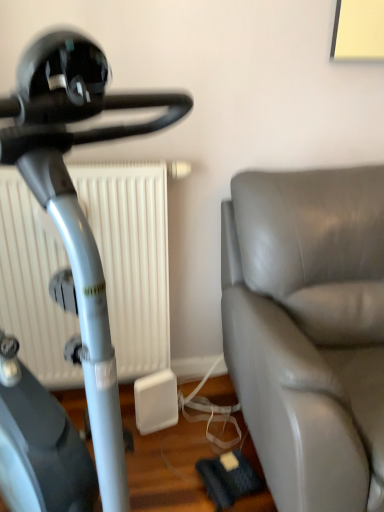
This screenshot has width=384, height=512. What do you see at coordinates (78, 207) in the screenshot? I see `matte black stationary bicycle at left` at bounding box center [78, 207].

The image size is (384, 512). Identify the location of gray leather couch at right. (308, 330).

You are a GUI agent. You are given a task and a screenshot of the screen. Output one action in this format:
    pyautogui.click(x=<x>, y=<y>)
    Task: Click on the white matte radiator at center
    The height and width of the screenshot is (512, 384).
    Given the screenshot: What is the action you would take?
    pyautogui.click(x=131, y=258)

Looking at this image, does gray leather couch at right turn towards white matte radiator at center?

No, gray leather couch at right is not facing towards white matte radiator at center.

How far apart are gray leather couch at right and white matte radiator at center?

gray leather couch at right is 22.91 inches from white matte radiator at center.

In the image, is gray leather couch at right on the left side or the right side of white matte radiator at center?

gray leather couch at right is to the right of white matte radiator at center.

You are a GUI agent. You are given a task and a screenshot of the screen. Output one action in this format:
    pyautogui.click(x=<x>, y=<y>)
    Task: Click on the studio couch in front of the white matte radiator at center
    The height and width of the screenshot is (512, 384).
    Given the screenshot: What is the action you would take?
    pyautogui.click(x=308, y=330)

Considering the positions of point (131, 248) and point (337, 301), is point (131, 248) closer or farther from the camera than point (337, 301)?

Point (131, 248) is farther from the camera than point (337, 301).

From a real-world perspective, between white matte radiator at center and gray leather couch at right, who is vertically lower?

gray leather couch at right, from a real-world perspective.

This screenshot has width=384, height=512. I want to click on studio couch beneath the white matte radiator at center (from a real-world perspective), so click(x=308, y=330).

From a real-world perspective, which object stands above the other?

In real-world perspective, matte black stationary bicycle at left is above.

Would you say matte black stationary bicycle at left is a long distance from white matte radiator at center?

matte black stationary bicycle at left is near white matte radiator at center, not far away.

Between point (57, 467) and point (8, 298), which one is positioned in front?

The point (57, 467) is in front.

In the image, is matte black stationary bicycle at left positioned in front of or behind white matte radiator at center?

matte black stationary bicycle at left is in front of white matte radiator at center.

Based on their positions, is gray leather couch at right located to the left or right of matte black stationary bicycle at left?

Based on their positions, gray leather couch at right is located to the right of matte black stationary bicycle at left.

In the scene shown: From the image's perspective, is gray leather couch at right located beneath matte black stationary bicycle at left?

Yes.

Find the location of `studio couch lying on the right of matte black stationary bicycle at left`. studio couch lying on the right of matte black stationary bicycle at left is located at coordinates (308, 330).

From a real-world perspective, who is located higher, gray leather couch at right or matte black stationary bicycle at left?

matte black stationary bicycle at left is physically above.

Is point (98, 210) behind point (103, 339)?

Yes, point (98, 210) is farther from viewer.

Is white matte radiator at center placed right next to matte black stationary bicycle at left?

No.

Find the location of a particular element. Image resolution: width=384 pixels, height=512 pixels. stationary bicycle on the right side of white matte radiator at center is located at coordinates (78, 207).

From the image's perspective, is white matte radiator at center beneath matte black stationary bicycle at left?

No, from the image's perspective, white matte radiator at center is not beneath matte black stationary bicycle at left.

From a real-world perspective, is matte black stationary bicycle at left physically located above or below gray leather couch at right?

matte black stationary bicycle at left is situated higher than gray leather couch at right in the real world.

Is gray leather couch at right at the back of matte black stationary bicycle at left?

That's not correct — matte black stationary bicycle at left is not looking away from gray leather couch at right.

Consider the image. Between matte black stationary bicycle at left and gray leather couch at right, which one has larger width?

gray leather couch at right is wider.

From the image's perspective, which is above, matte black stationary bicycle at left or gray leather couch at right?

matte black stationary bicycle at left, from the image's perspective.

You are a GUI agent. You are given a task and a screenshot of the screen. Output one action in this format:
    pyautogui.click(x=<x>, y=<y>)
    Task: Click on the studio couch located underneath the white matte radiator at center (from a real-world perspective)
    
    Given the screenshot: What is the action you would take?
    pyautogui.click(x=308, y=330)

Locate an element on the screen. This screenshot has width=384, height=512. studio couch below the white matte radiator at center (from the image's perspective) is located at coordinates (308, 330).

Based on their spatial positions, is matte black stationary bicycle at left or gray leather couch at right closer to white matte radiator at center?

Among the two, gray leather couch at right is located nearer to white matte radiator at center.

Looking at the image, which one is located closer to gray leather couch at right, white matte radiator at center or matte black stationary bicycle at left?

white matte radiator at center lies closer to gray leather couch at right than the other object.

Looking at the image, which one is located closer to matte black stationary bicycle at left, gray leather couch at right or white matte radiator at center?

Among the two, gray leather couch at right is located nearer to matte black stationary bicycle at left.

Which object lies further to the anchor point matte black stationary bicycle at left, white matte radiator at center or gray leather couch at right?

Among the two, white matte radiator at center is located further to matte black stationary bicycle at left.

Considering their positions, is gray leather couch at right positioned further to white matte radiator at center than matte black stationary bicycle at left?

matte black stationary bicycle at left is further to white matte radiator at center.

Based on their spatial positions, is matte black stationary bicycle at left or white matte radiator at center further from gray leather couch at right?

matte black stationary bicycle at left is positioned further to the anchor gray leather couch at right.

Identify the location of stationary bicycle situated between white matte radiator at center and gray leather couch at right from left to right. Image resolution: width=384 pixels, height=512 pixels. (78, 207).